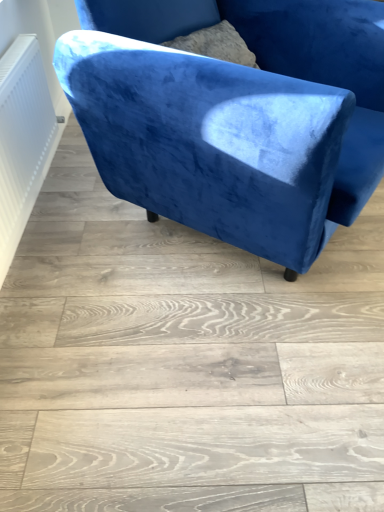
I want to click on free location in front of white textured radiator at left, so click(x=71, y=287).